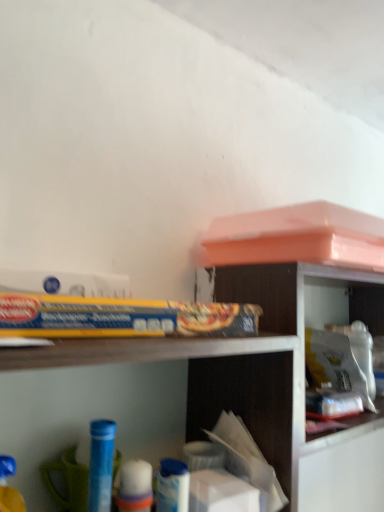
Question: From the image's perspective, would you say wooden bookshelf at upper right is positioned over wooden shelf at upper center?

Choices:
 (A) no
 (B) yes

Answer: (B)

Question: Does wooden bookshelf at upper right lie in front of wooden shelf at upper center?

Choices:
 (A) no
 (B) yes

Answer: (A)

Question: Considering the relative sizes of wooden bookshelf at upper right and wooden shelf at upper center in the image provided, is wooden bookshelf at upper right taller than wooden shelf at upper center?

Choices:
 (A) no
 (B) yes

Answer: (A)

Question: Is the depth of wooden bookshelf at upper right greater than that of wooden shelf at upper center?

Choices:
 (A) yes
 (B) no

Answer: (A)

Question: Is wooden bookshelf at upper right facing away from wooden shelf at upper center?

Choices:
 (A) yes
 (B) no

Answer: (B)

Question: Does point (187, 397) appear closer or farther from the camera than point (297, 414)?

Choices:
 (A) farther
 (B) closer

Answer: (A)

Question: From the image's perspective, is wooden bookshelf at upper right located above or below white plastic container at upper right?

Choices:
 (A) below
 (B) above

Answer: (B)

Question: In terms of width, does wooden bookshelf at upper right look wider or thinner when compared to white plastic container at upper right?

Choices:
 (A) wide
 (B) thin

Answer: (A)

Question: In terms of size, does wooden bookshelf at upper right appear bigger or smaller than white plastic container at upper right?

Choices:
 (A) small
 (B) big

Answer: (B)

Question: In the image, is white plastic container at upper right on the left side or the right side of blue plastic tube at lower left, positioned as the 2th toy in front-to-back order?

Choices:
 (A) right
 (B) left

Answer: (A)

Question: From their relative heights in the image, would you say white plastic container at upper right is taller or shorter than blue plastic tube at lower left, which ranks as the 1th toy in back-to-front order?

Choices:
 (A) short
 (B) tall

Answer: (B)

Question: In terms of width, does white plastic container at upper right look wider or thinner when compared to blue plastic tube at lower left, which is counted as the 2th toy, starting from the left?

Choices:
 (A) wide
 (B) thin

Answer: (A)

Question: Would you say white plastic container at upper right is inside or outside blue plastic tube at lower left, positioned as the 2th toy in front-to-back order?

Choices:
 (A) inside
 (B) outside

Answer: (B)

Question: Considering the relative positions of wooden bookshelf at upper right and blue plastic toy at lower left, the second toy positioned from the right, in the image provided, is wooden bookshelf at upper right to the left or to the right of blue plastic toy at lower left, the second toy positioned from the right,?

Choices:
 (A) right
 (B) left

Answer: (A)

Question: Looking at the image, does wooden bookshelf at upper right seem bigger or smaller compared to blue plastic toy at lower left, which appears as the 1th toy when viewed from the front?

Choices:
 (A) small
 (B) big

Answer: (B)